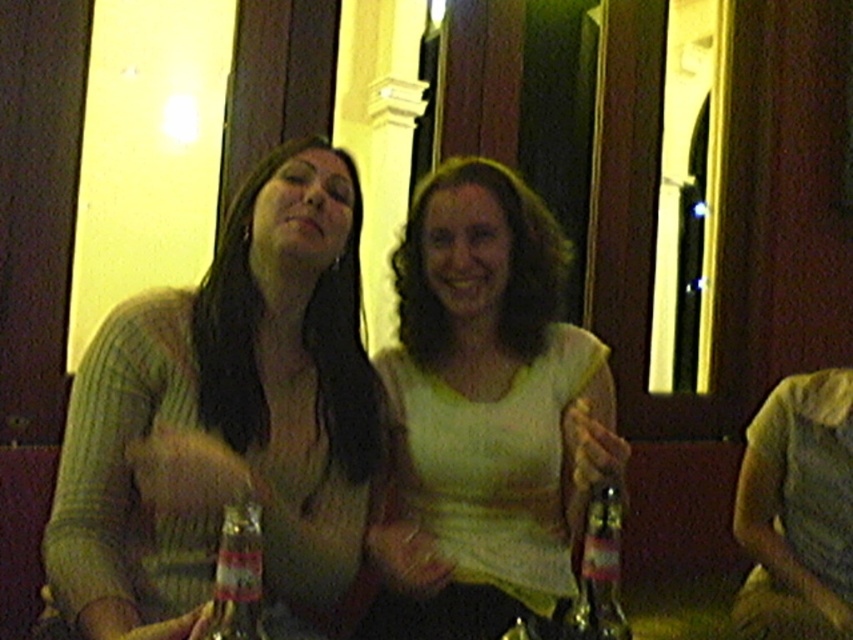
You are at a party and want to grab the translucent glass bottle at center without disturbing the person wearing the knitted sweater at left. Which direction should you move relative to the bottle to avoid them?

The knitted sweater at left is located above the translucent glass bottle at center, so you should move downward from the bottle to avoid the person wearing the knitted sweater at left.

You are a bartender at the event and need to place both the translucent glass bottle at center and the clear glass bottle at center on a shelf that is 15 inches wide. Can both bottles fit side by side on the shelf without overlapping?

The translucent glass bottle at center is 13.37 inches from the clear glass bottle at center, so yes, both bottles can fit side by side on the 15 inch shelf since the distance between them is less than the shelf width.